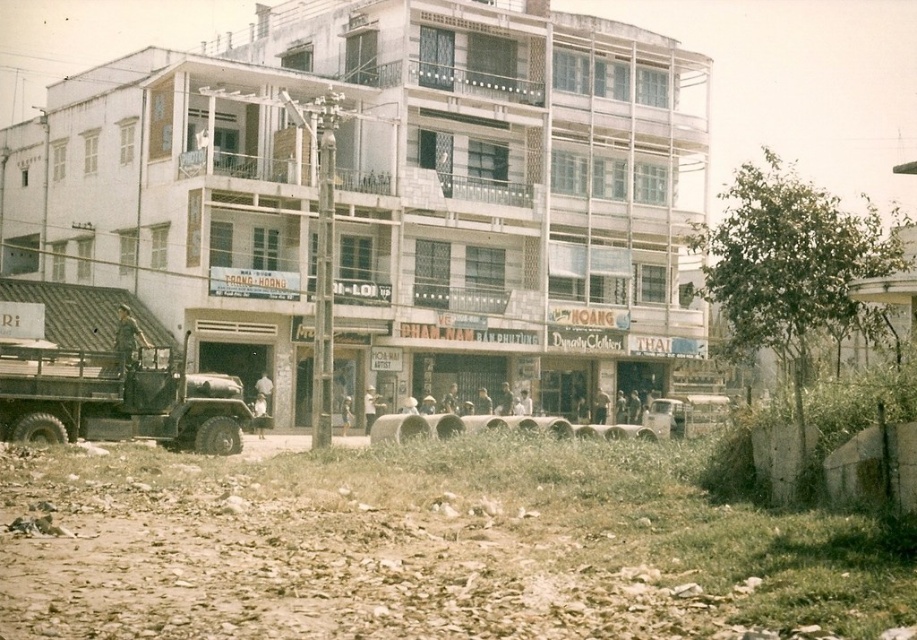
You are a pedestrian standing on the street and want to cross to the other side. There is a matte black truck at left and a metallic silver car at center. Which vehicle is closer to you?

The matte black truck at left is closer to you than the metallic silver car at center.

You are a delivery person who needs to park your vehicle in this area. You have a matte black truck at left and a metallic silver car at center. Which vehicle takes up more space in the parking spot?

The matte black truck at left is larger in size compared to the metallic silver car at center, so it takes up more space in the parking spot.

You are a delivery driver trying to navigate through this street. There is a matte black truck at left. Where is the matte black truck located in relation to the point at coordinates (116, 401)?

The point at coordinates (116, 401) indicates the location of the matte black truck at left, so the truck is exactly at that point.